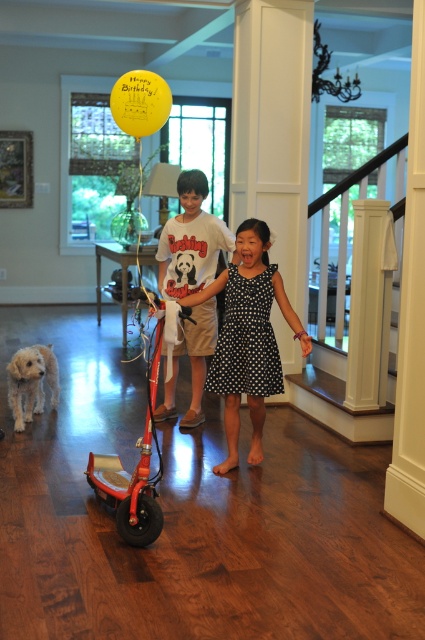
Can you confirm if black dotted dress at center is shorter than white cotton t-shirt at center?

Indeed, black dotted dress at center has a lesser height compared to white cotton t-shirt at center.

Between black dotted dress at center and white cotton t-shirt at center, which one has less height?

Standing shorter between the two is black dotted dress at center.

Which is behind, point (227, 332) or point (198, 188)?

Positioned behind is point (198, 188).

Locate an element on the screen. black dotted dress at center is located at coordinates coord(248,337).

Between metallic red scooter at center and white fluffy dog at lower left, which one has less height?

With less height is white fluffy dog at lower left.

How much distance is there between metallic red scooter at center and white fluffy dog at lower left?

The distance of metallic red scooter at center from white fluffy dog at lower left is 5.67 feet.

Find the location of `metallic red scooter at center`. metallic red scooter at center is located at coordinates (133, 468).

Does black dotted dress at center have a larger size compared to yellow matte balloon at upper center?

Correct, black dotted dress at center is larger in size than yellow matte balloon at upper center.

Can you confirm if black dotted dress at center is taller than yellow matte balloon at upper center?

Yes.

What do you see at coordinates (248, 337) in the screenshot? I see `black dotted dress at center` at bounding box center [248, 337].

Where is `black dotted dress at center`? Image resolution: width=425 pixels, height=640 pixels. black dotted dress at center is located at coordinates (248, 337).